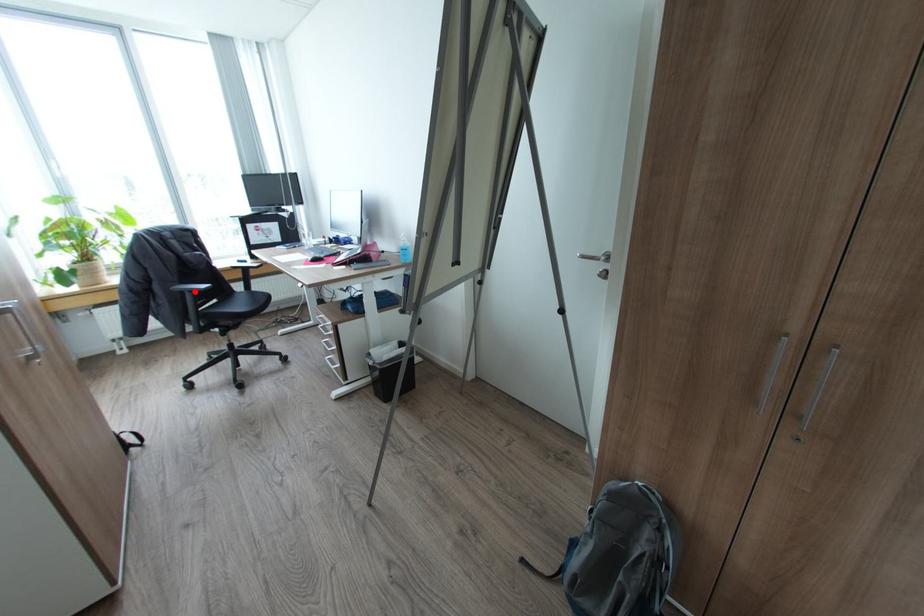
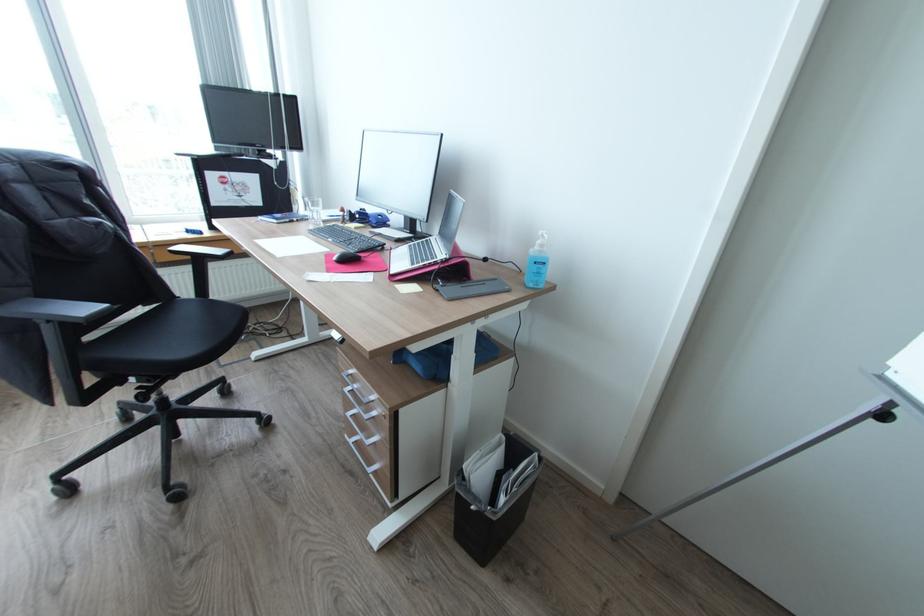
Locate, in the second image, the point that corresponds to the highlighted location in the first image.

(55, 321)